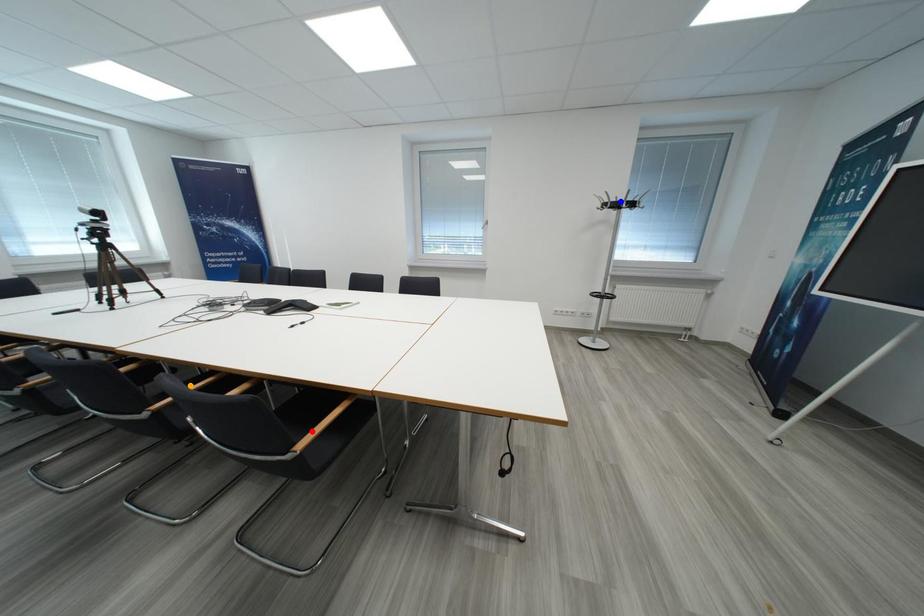
Order these from nearest to farthest:
1. orange point
2. red point
3. blue point

blue point → orange point → red point